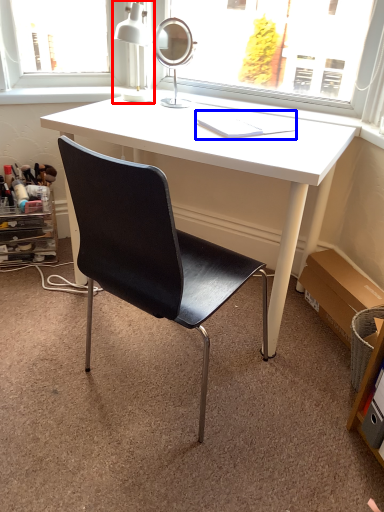
Question: Which object is closer to the camera taking this photo, table lamp (highlighted by a red box) or book (highlighted by a blue box)?

Choices:
 (A) table lamp
 (B) book

Answer: (B)